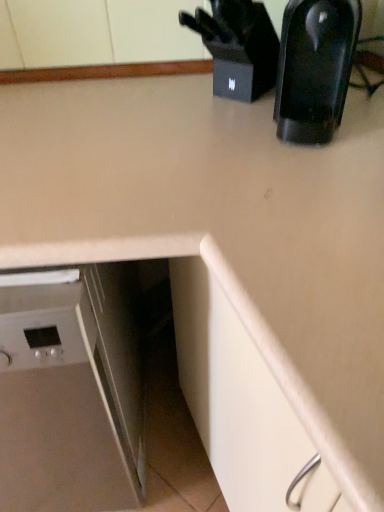
Question: From a real-world perspective, is black glossy coffee maker at upper right located beneath white glossy dishwasher at lower left?

Choices:
 (A) no
 (B) yes

Answer: (A)

Question: From the image's perspective, is black glossy coffee maker at upper right under white glossy dishwasher at lower left?

Choices:
 (A) yes
 (B) no

Answer: (B)

Question: Can you confirm if black glossy coffee maker at upper right is smaller than white glossy dishwasher at lower left?

Choices:
 (A) yes
 (B) no

Answer: (A)

Question: Considering the relative sizes of black glossy coffee maker at upper right and white glossy dishwasher at lower left in the image provided, is black glossy coffee maker at upper right taller than white glossy dishwasher at lower left?

Choices:
 (A) no
 (B) yes

Answer: (A)

Question: Is black glossy coffee maker at upper right looking in the opposite direction of white glossy dishwasher at lower left?

Choices:
 (A) no
 (B) yes

Answer: (A)

Question: Considering the relative positions of black glossy coffee maker at upper right and white glossy dishwasher at lower left in the image provided, is black glossy coffee maker at upper right to the left of white glossy dishwasher at lower left from the viewer's perspective?

Choices:
 (A) yes
 (B) no

Answer: (B)

Question: Is black plastic knife block at upper right looking in the opposite direction of white glossy dishwasher at lower left?

Choices:
 (A) yes
 (B) no

Answer: (B)

Question: Can white glossy dishwasher at lower left be found inside black plastic knife block at upper right?

Choices:
 (A) no
 (B) yes

Answer: (A)

Question: From the image's perspective, does black plastic knife block at upper right appear lower than white glossy dishwasher at lower left?

Choices:
 (A) no
 (B) yes

Answer: (A)

Question: Is black plastic knife block at upper right taller than white glossy dishwasher at lower left?

Choices:
 (A) yes
 (B) no

Answer: (B)

Question: Is black plastic knife block at upper right smaller than white glossy dishwasher at lower left?

Choices:
 (A) yes
 (B) no

Answer: (A)

Question: Considering the relative positions of black plastic knife block at upper right and white glossy dishwasher at lower left in the image provided, is black plastic knife block at upper right to the left of white glossy dishwasher at lower left from the viewer's perspective?

Choices:
 (A) no
 (B) yes

Answer: (A)

Question: From the image's perspective, is white glossy dishwasher at lower left on top of black plastic knife block at upper right?

Choices:
 (A) yes
 (B) no

Answer: (B)